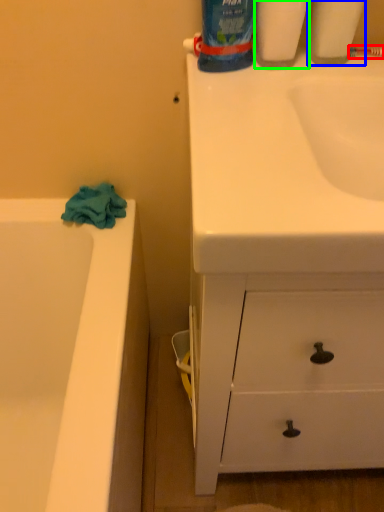
Question: Which is nearer to the toothbrush (highlighted by a red box)? cleaning product (highlighted by a blue box) or cleaning product (highlighted by a green box).

Choices:
 (A) cleaning product
 (B) cleaning product

Answer: (A)